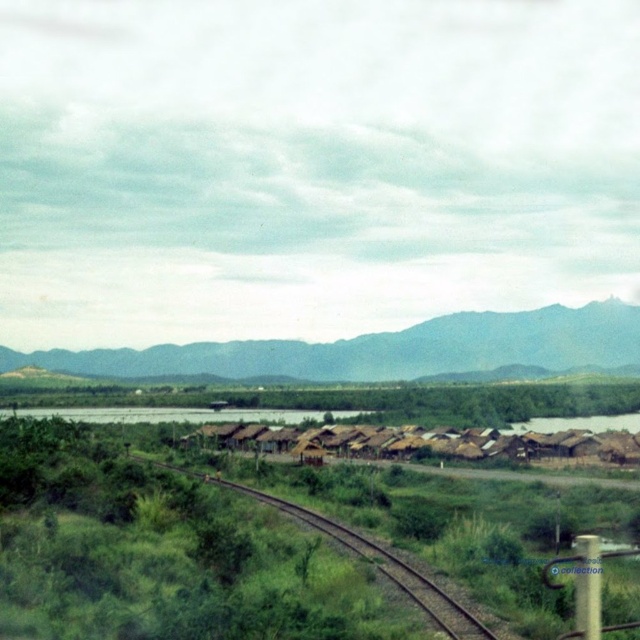
Is brown thatched-roof village at center in front of green grassy track at center?

That is False.

This screenshot has height=640, width=640. I want to click on brown thatched-roof village at center, so click(x=420, y=442).

Can you confirm if green grassy mountain at upper center is shorter than green grassy track at center?

In fact, green grassy mountain at upper center may be taller than green grassy track at center.

Does green grassy mountain at upper center have a lesser width compared to green grassy track at center?

Incorrect, green grassy mountain at upper center's width is not less than green grassy track at center's.

Who is more distant from viewer, (211, 348) or (408, 568)?

Positioned behind is point (211, 348).

In order to click on green grassy mountain at upper center in this screenshot , I will do `click(381, 349)`.

Can you confirm if green grassy mountain at upper center is wider than brown thatched-roof village at center?

Yes, green grassy mountain at upper center is wider than brown thatched-roof village at center.

Does green grassy mountain at upper center have a lesser width compared to brown thatched-roof village at center?

No.

Find the location of a particular element. The width and height of the screenshot is (640, 640). green grassy mountain at upper center is located at coordinates click(x=381, y=349).